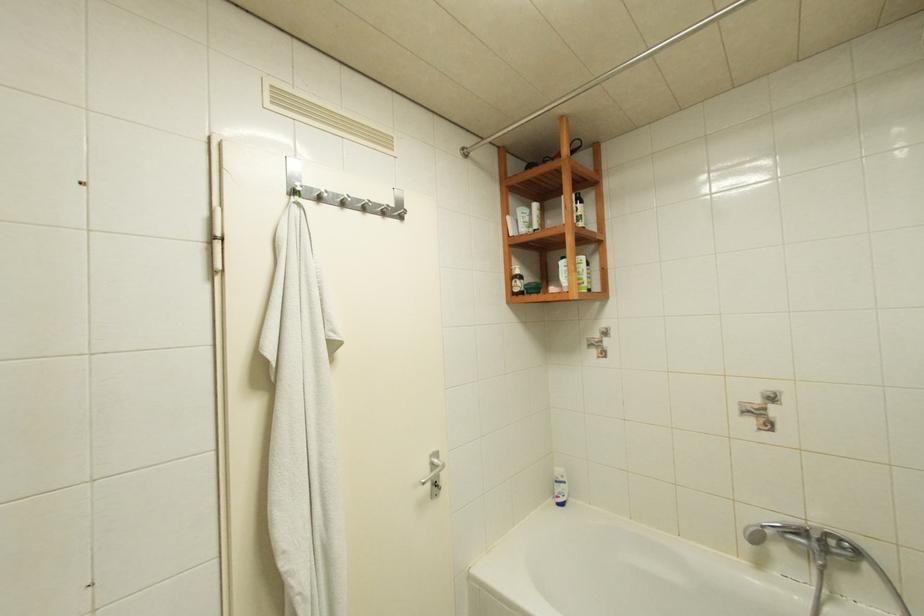
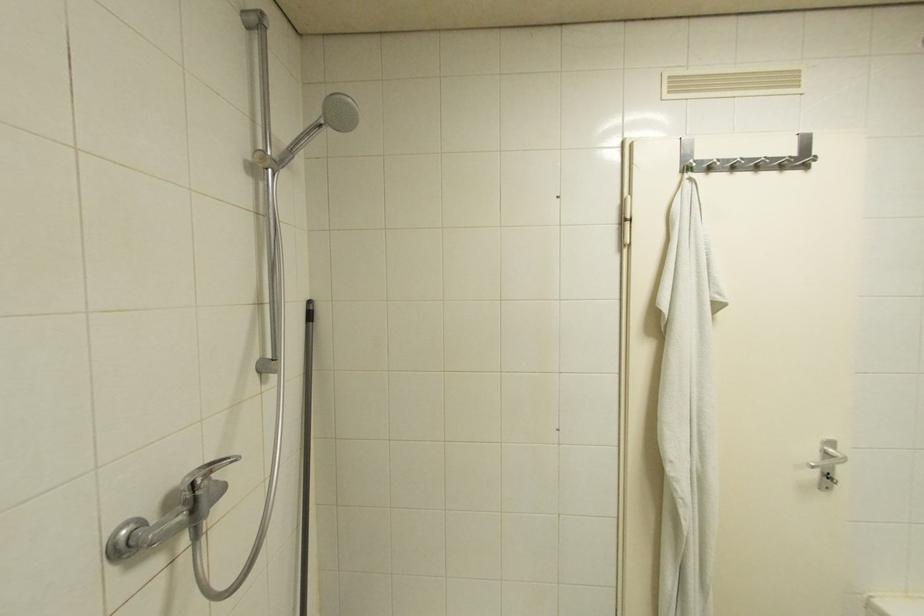
Question: The camera is either moving clockwise (left) or counter-clockwise (right) around the object. The first image is from the beginning of the video and the second image is from the end. Is the camera moving left or right when shooting the video?

Choices:
 (A) Left
 (B) Right

Answer: (B)